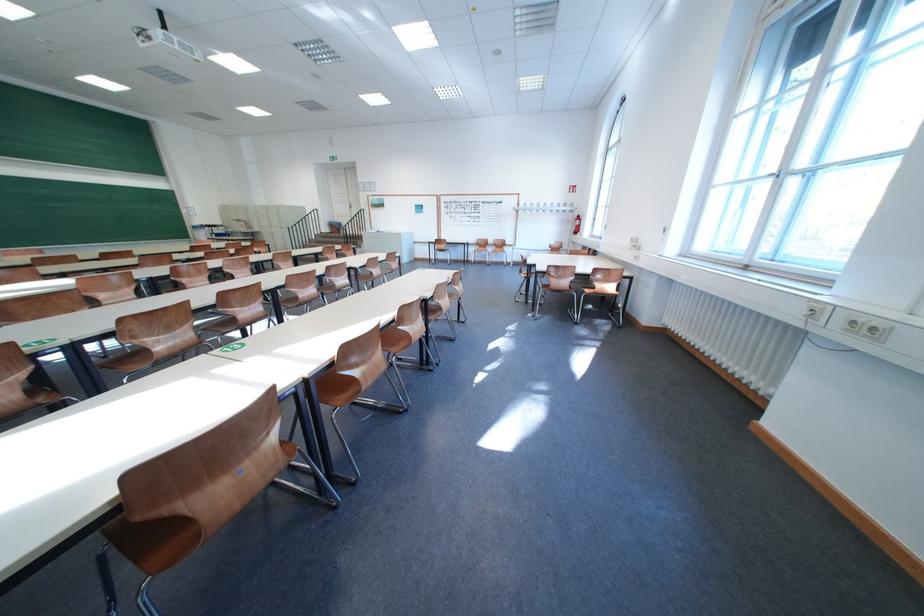
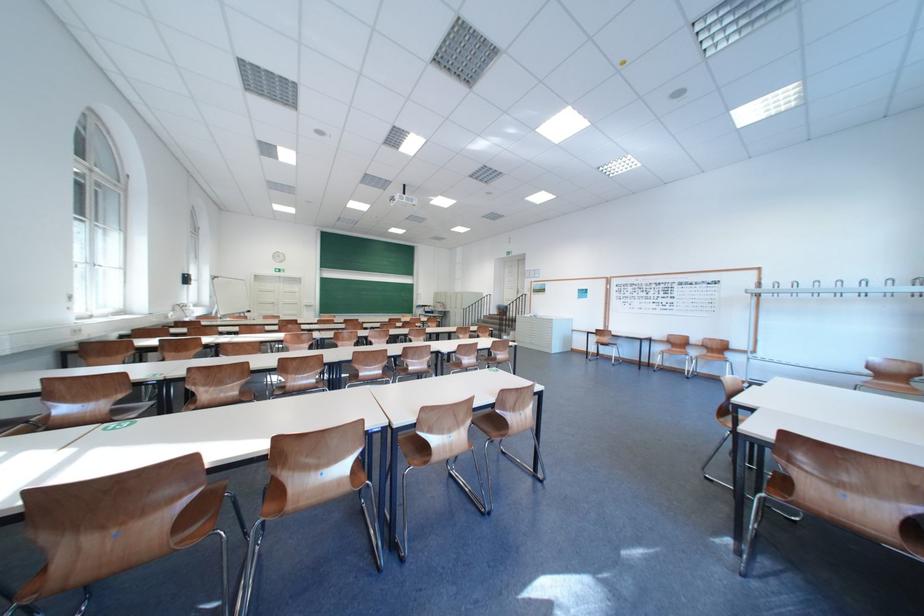
Locate, in the second image, the point that corresponds to point 487,251 in the first image.

(673, 350)